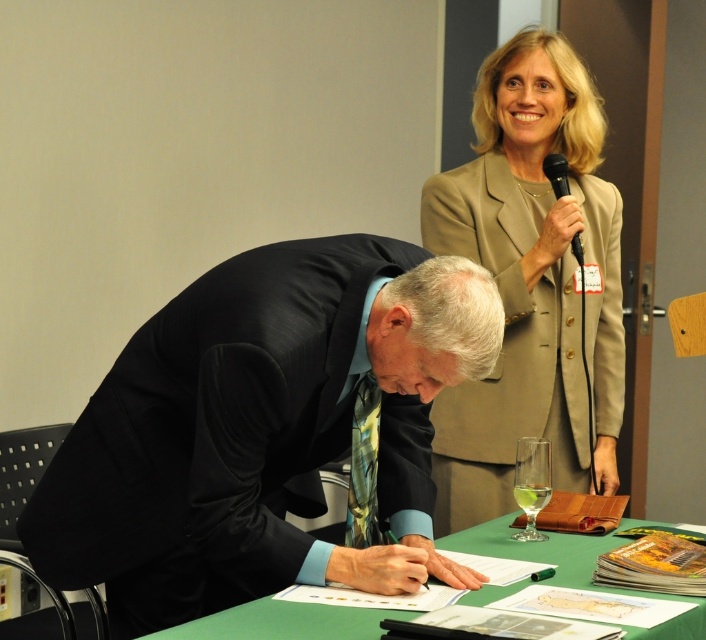
Does point (574, 440) come closer to viewer compared to point (575, 237)?

No, it is behind (575, 237).

Is point (479, 156) closer to camera compared to point (563, 173)?

That is False.

I want to click on beige fabric suit at upper right, so click(x=530, y=282).

Can you confirm if green matte table at lower center is shorter than clear glass wine glass at lower center?

Yes.

Is green matte table at lower center to the left of clear glass wine glass at lower center from the viewer's perspective?

Indeed, green matte table at lower center is positioned on the left side of clear glass wine glass at lower center.

Is point (686, 621) closer to camera compared to point (517, 477)?

Yes.

Locate an element on the screen. green matte table at lower center is located at coordinates (285, 621).

Who is positioned more to the right, black silk suit at center or metallic silver microphone at upper right?

metallic silver microphone at upper right

Can you confirm if black silk suit at center is positioned above metallic silver microphone at upper right?

No, black silk suit at center is not above metallic silver microphone at upper right.

This screenshot has width=706, height=640. I want to click on black silk suit at center, so click(258, 426).

This screenshot has height=640, width=706. I want to click on black silk suit at center, so click(x=258, y=426).